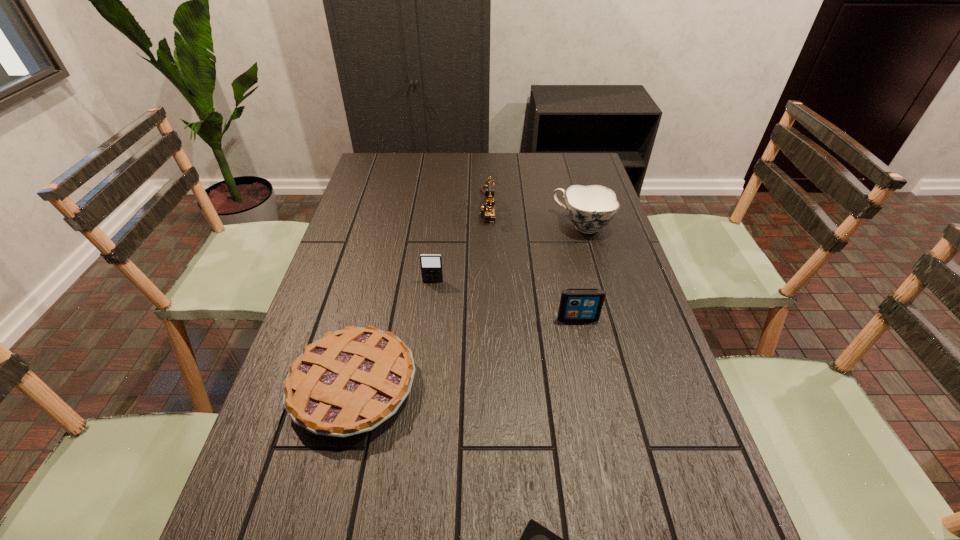
Find the location of a particular element. The height and width of the screenshot is (540, 960). vacant point located on the front-facing side of the telephone is located at coordinates (397, 206).

Find the location of a particular element. This screenshot has width=960, height=540. blank space located 0.130m on the back of the chinaware is located at coordinates (572, 191).

You are a GUI agent. You are given a task and a screenshot of the screen. Output one action in this format:
    pyautogui.click(x=<x>, y=<y>)
    Task: Click on the vacant space located 0.180m on the front screen of the second farthest iPod
    
    Given the screenshot: What is the action you would take?
    pyautogui.click(x=591, y=380)

Locate an element on the screen. vacant space located on the front-facing side of the leftmost iPod is located at coordinates (430, 308).

The image size is (960, 540). I want to click on vacant region located 0.080m on the front of the fifth tallest object, so click(x=329, y=487).

Where is `object situated at the left edge`? This screenshot has width=960, height=540. object situated at the left edge is located at coordinates click(x=350, y=381).

Where is `chinaware at the right edge`? chinaware at the right edge is located at coordinates (590, 208).

Locate an element on the screen. Image resolution: width=960 pixels, height=540 pixels. iPod situated at the right edge is located at coordinates (576, 304).

You are a GUI agent. You are given a task and a screenshot of the screen. Output one action in this format:
    pyautogui.click(x=<x>, y=<y>)
    Task: Click on the vacant area at the far edge
    This screenshot has height=540, width=960.
    Given the screenshot: What is the action you would take?
    pyautogui.click(x=556, y=184)

The image size is (960, 540). I want to click on free space at the left edge of the desktop, so click(x=318, y=294).